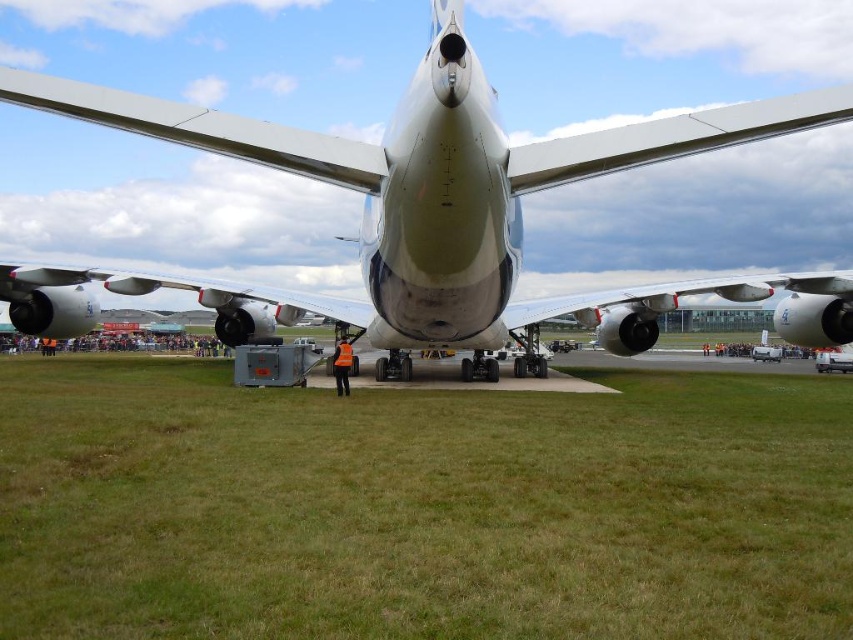
Is the position of green grass at center less distant than that of metallic silver airplane at center?

Yes, green grass at center is closer to the viewer.

Can you confirm if green grass at center is thinner than metallic silver airplane at center?

Indeed, green grass at center has a lesser width compared to metallic silver airplane at center.

Is point (181, 392) behind point (433, 68)?

Yes.

At what (x,y) coordinates should I click in order to perform the action: click on green grass at center. Please return your answer as a coordinate pair (x, y). Looking at the image, I should click on (421, 508).